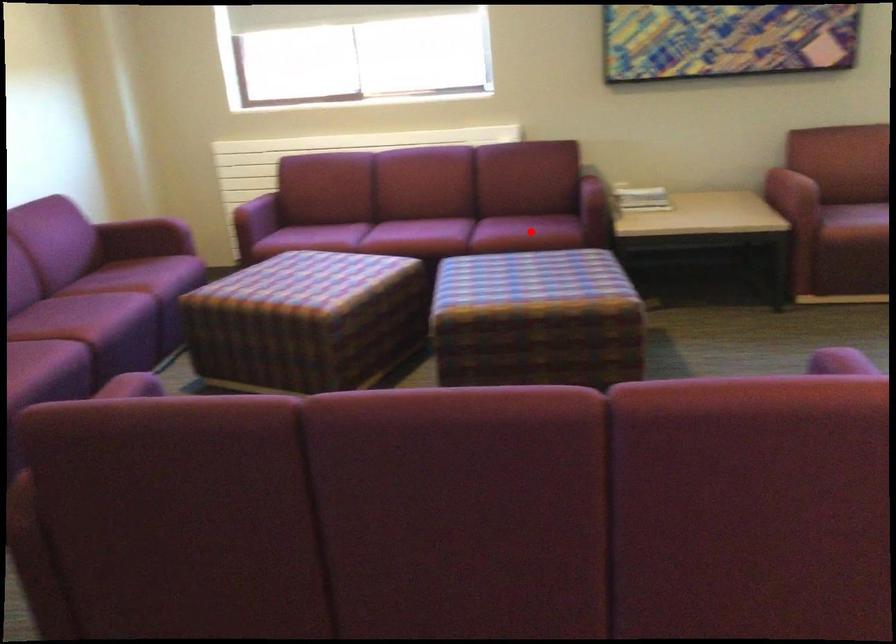
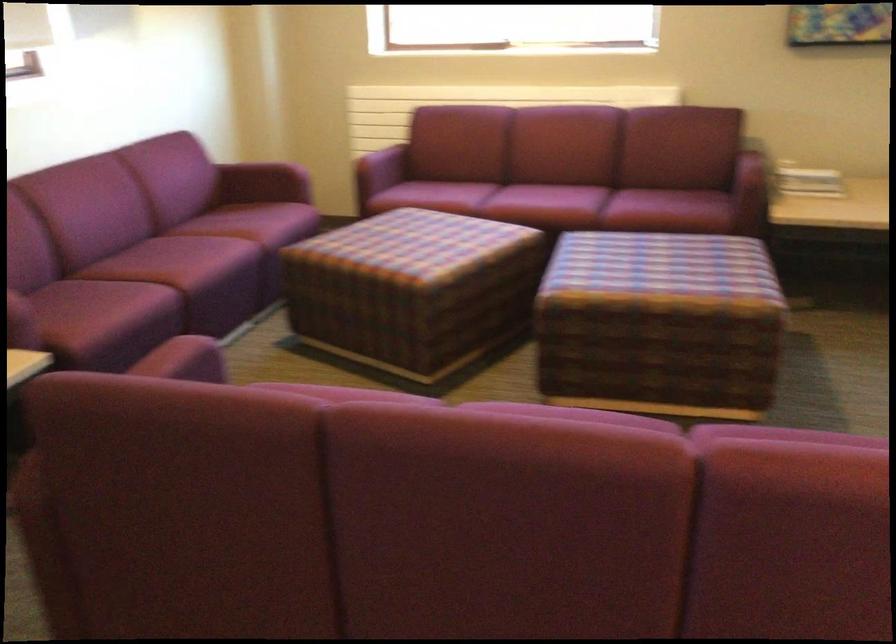
The point at the highlighted location is marked in the first image. Where is the corresponding point in the second image?

(668, 211)